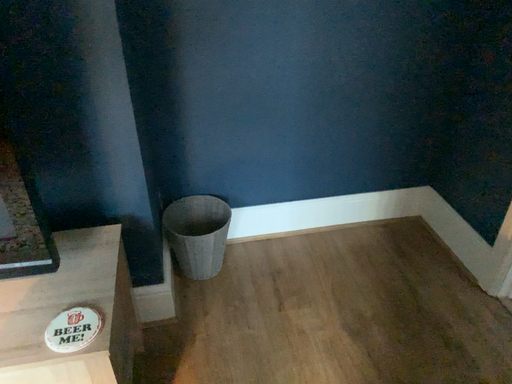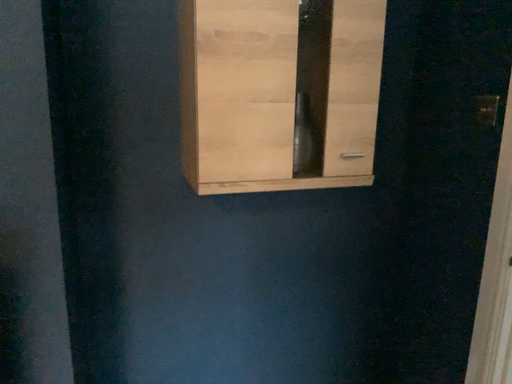
Question: Which way did the camera rotate in the video?

Choices:
 (A) rotated downward
 (B) rotated upward

Answer: (B)